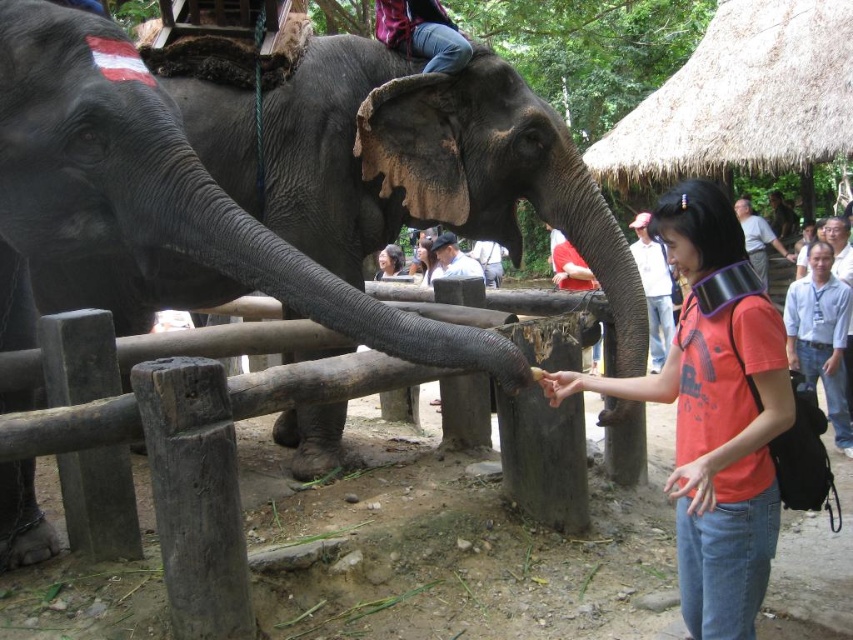
Is dark gray skin elephant at center positioned behind orange t-shirt at center?

Yes, dark gray skin elephant at center is behind orange t-shirt at center.

Can you confirm if dark gray skin elephant at center is bigger than orange t-shirt at center?

Incorrect, dark gray skin elephant at center is not larger than orange t-shirt at center.

Does point (318, 285) lie in front of point (699, 442)?

That is False.

You are a GUI agent. You are given a task and a screenshot of the screen. Output one action in this format:
    pyautogui.click(x=<x>, y=<y>)
    Task: Click on the dark gray skin elephant at center
    
    Given the screenshot: What is the action you would take?
    [149, 189]